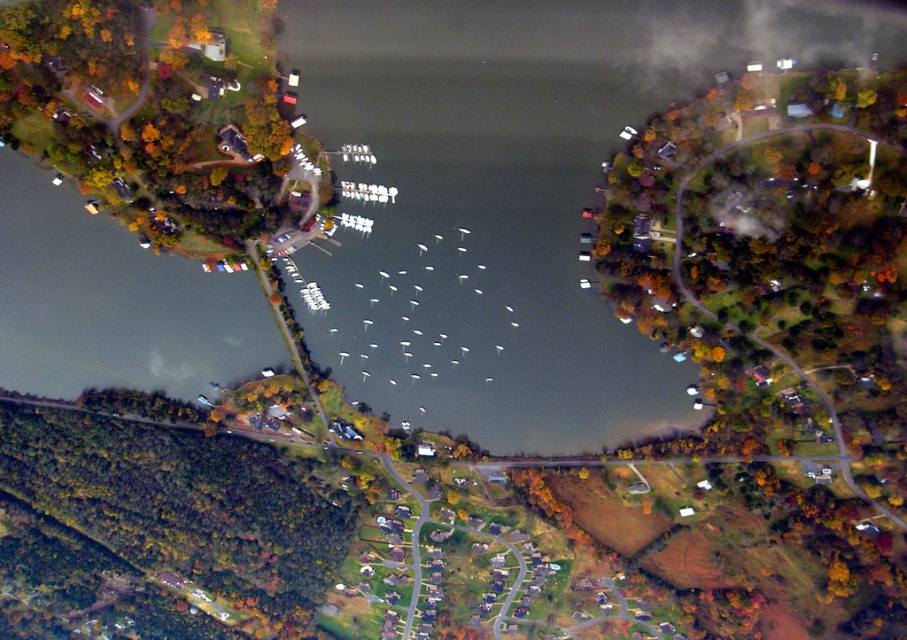
Question: Which point is closer to the camera taking this photo?

Choices:
 (A) (189, 560)
 (B) (850, 116)

Answer: (B)

Question: Can you confirm if green leafy trees at center is thinner than green leafy trees at lower left?

Choices:
 (A) yes
 (B) no

Answer: (A)

Question: Which of the following is the farthest from the observer?

Choices:
 (A) (719, 500)
 (B) (123, 429)

Answer: (A)

Question: Which point is closer to the camera taking this photo?

Choices:
 (A) (66, 520)
 (B) (738, 419)

Answer: (B)

Question: Can you confirm if green leafy trees at center is thinner than green leafy trees at lower left?

Choices:
 (A) yes
 (B) no

Answer: (A)

Question: Is the position of green leafy trees at center less distant than that of green leafy trees at lower left?

Choices:
 (A) no
 (B) yes

Answer: (B)